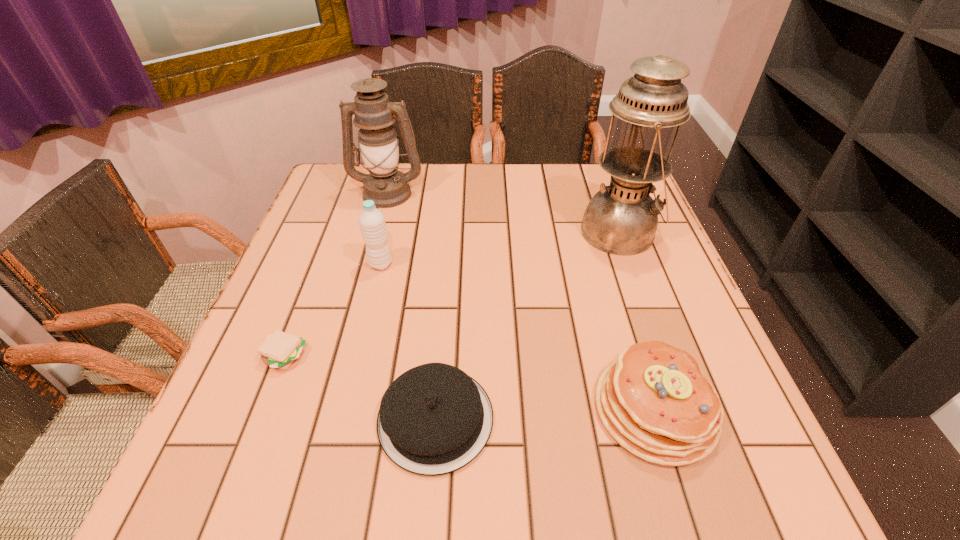
Where is `vacant space that satisfies the following two spatial constraints: 1. on the back side of the patty; 2. on the left side of the fifth shortest object`? Image resolution: width=960 pixels, height=540 pixels. vacant space that satisfies the following two spatial constraints: 1. on the back side of the patty; 2. on the left side of the fifth shortest object is located at coordinates (348, 193).